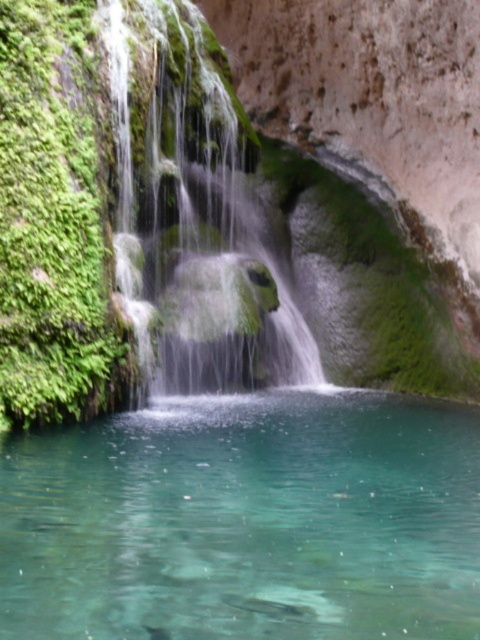
Is the position of clear glass water at center more distant than that of green mossy waterfall at center?

No, clear glass water at center is in front of green mossy waterfall at center.

Who is higher up, clear glass water at center or green mossy waterfall at center?

Positioned higher is green mossy waterfall at center.

What do you see at coordinates (247, 518) in the screenshot? I see `clear glass water at center` at bounding box center [247, 518].

Find the location of a particular element. The height and width of the screenshot is (640, 480). clear glass water at center is located at coordinates (247, 518).